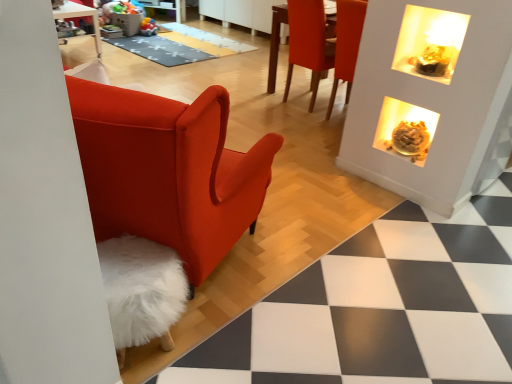
This screenshot has height=384, width=512. What do you see at coordinates (405, 130) in the screenshot? I see `translucent glass bowl at upper right` at bounding box center [405, 130].

Find the location of a particular element. The image size is (512, 384). matte orange chair at upper right is located at coordinates (308, 42).

At what (x,y) coordinates should I click in order to perform the action: click on translucent glass bowl at upper right. Please return your answer as a coordinate pair (x, y). The image size is (512, 384). Looking at the image, I should click on (405, 130).

From the image's perspective, is matte orange chair at upper right located above translucent glass bowl at upper right?

Yes, from the image's perspective, matte orange chair at upper right is over translucent glass bowl at upper right.

Considering the relative positions of matte orange chair at upper right and translucent glass bowl at upper right in the image provided, is matte orange chair at upper right to the right of translucent glass bowl at upper right from the viewer's perspective?

Incorrect, matte orange chair at upper right is not on the right side of translucent glass bowl at upper right.

You are a GUI agent. You are given a task and a screenshot of the screen. Output one action in this format:
    pyautogui.click(x=<x>, y=<y>)
    Task: Click on the fireplace that is below the matte orange chair at upper right (from the image's perspective)
    Image resolution: width=512 pixels, height=384 pixels.
    Given the screenshot: What is the action you would take?
    pyautogui.click(x=405, y=130)

Which of these two, matte orange chair at upper right or translucent glass bowl at upper right, stands taller?

Standing taller between the two is matte orange chair at upper right.

Does translucent glass bowl at upper right come in front of matte orange chair at upper right?

Yes, translucent glass bowl at upper right is closer to the viewer.

Considering the relative positions of translucent glass bowl at upper right and matte orange chair at upper right in the image provided, is translucent glass bowl at upper right to the right of matte orange chair at upper right from the viewer's perspective?

Correct, you'll find translucent glass bowl at upper right to the right of matte orange chair at upper right.

Is translucent glass bowl at upper right positioned with its back to matte orange chair at upper right?

translucent glass bowl at upper right does not have its back to matte orange chair at upper right.

Is translucent glass bowl at upper right inside the boundaries of matte orange chair at upper right, or outside?

The correct answer is: outside.

Consider the image. How different are the orientations of translucent glass bowl at upper right and gray textured mat at center in degrees?

There is a 90.7-degree angle between the facing directions of translucent glass bowl at upper right and gray textured mat at center.

Is translucent glass bowl at upper right completely or partially outside of gray textured mat at center?

That's correct, translucent glass bowl at upper right is outside of gray textured mat at center.

Considering the positions of objects translucent glass bowl at upper right and gray textured mat at center in the image provided, who is in front, translucent glass bowl at upper right or gray textured mat at center?

translucent glass bowl at upper right is in front.

Is translucent glass bowl at upper right next to gray textured mat at center and touching it?

There is a gap between translucent glass bowl at upper right and gray textured mat at center.

Is matte orange chair at upper right not within gray textured mat at center?

Yes, matte orange chair at upper right is not within gray textured mat at center.

Is point (334, 39) positioned after point (176, 56)?

No.

From the image's perspective, is matte orange chair at upper right above or below gray textured mat at center?

matte orange chair at upper right is situated lower than gray textured mat at center in the image.

Are matte orange chair at upper right and gray textured mat at center located far from each other?

Yes, matte orange chair at upper right is far from gray textured mat at center.

Is point (174, 52) closer to viewer compared to point (307, 36)?

No, (174, 52) is behind (307, 36).

Is gray textured mat at center positioned beyond the bounds of matte orange chair at upper right?

Absolutely, gray textured mat at center is external to matte orange chair at upper right.

How many degrees apart are the facing directions of gray textured mat at center and matte orange chair at upper right?

88.2 degrees.

Which is farther, [143,37] or [397,103]?

The point [143,37] is more distant.

Is translucent glass bowl at upper right completely or partially inside gray textured mat at center?

No, translucent glass bowl at upper right is located outside of gray textured mat at center.

In the scene shown: Is gray textured mat at center to the left or to the right of translucent glass bowl at upper right in the image?

In the image, gray textured mat at center appears on the left side of translucent glass bowl at upper right.

The width and height of the screenshot is (512, 384). I want to click on fireplace below the matte orange chair at upper right (from a real-world perspective), so click(405, 130).

The height and width of the screenshot is (384, 512). I want to click on chair above the translucent glass bowl at upper right (from a real-world perspective), so click(x=308, y=42).

From the image, which object appears to be farther from gray textured mat at center, translucent glass bowl at upper right or matte orange chair at upper right?

translucent glass bowl at upper right is positioned further to the anchor gray textured mat at center.

Estimate the real-world distances between objects in this image. Which object is further from translucent glass bowl at upper right, matte orange chair at upper right or gray textured mat at center?

The object further to translucent glass bowl at upper right is gray textured mat at center.

Based on their spatial positions, is gray textured mat at center or matte orange chair at upper right closer to translucent glass bowl at upper right?

Based on the image, matte orange chair at upper right appears to be nearer to translucent glass bowl at upper right.

In the scene shown: When comparing their distances from matte orange chair at upper right, does translucent glass bowl at upper right or gray textured mat at center seem further?

Based on the image, gray textured mat at center appears to be further to matte orange chair at upper right.

Which object lies nearer to the anchor point gray textured mat at center, matte orange chair at upper right or translucent glass bowl at upper right?

Among the two, matte orange chair at upper right is located nearer to gray textured mat at center.

Based on their spatial positions, is gray textured mat at center or translucent glass bowl at upper right further from matte orange chair at upper right?

gray textured mat at center.

Image resolution: width=512 pixels, height=384 pixels. I want to click on chair between translucent glass bowl at upper right and gray textured mat at center along the z-axis, so click(x=308, y=42).